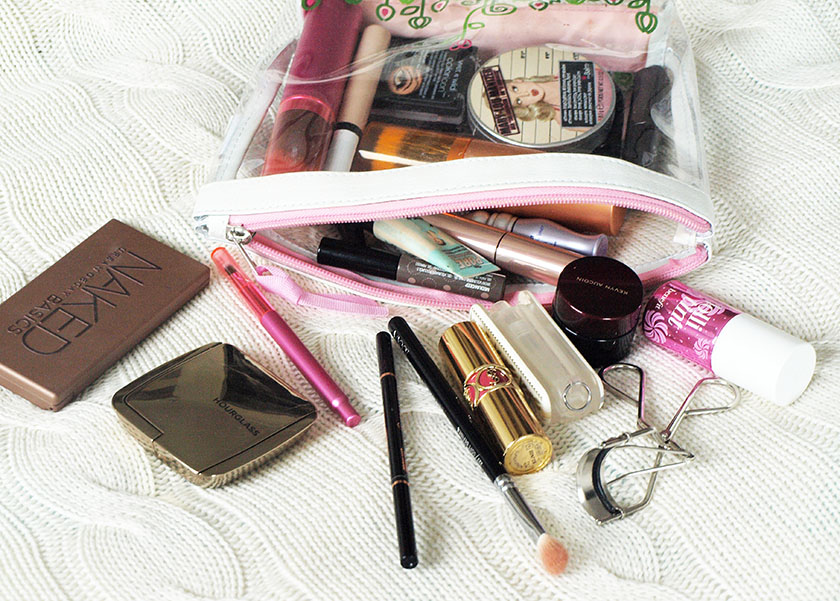
Locate an element on the screen. The image size is (840, 601). makeup brush is located at coordinates (548, 551).